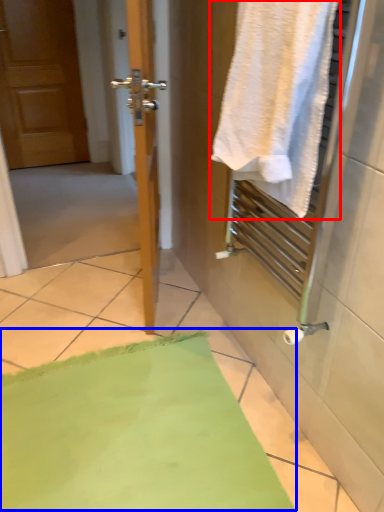
Question: Among these objects, which one is farthest to the camera, towel (highlighted by a red box) or bath mat (highlighted by a blue box)?

Choices:
 (A) towel
 (B) bath mat

Answer: (B)